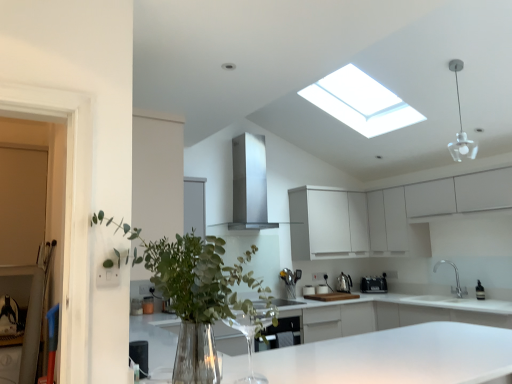
Question: Considering the relative positions of white glass pendant light at upper right and white glossy countertop at center in the image provided, is white glass pendant light at upper right to the left of white glossy countertop at center from the viewer's perspective?

Choices:
 (A) no
 (B) yes

Answer: (A)

Question: Can you confirm if white glass pendant light at upper right is taller than white glossy countertop at center?

Choices:
 (A) no
 (B) yes

Answer: (A)

Question: From a real-world perspective, is white glass pendant light at upper right located higher than white glossy countertop at center?

Choices:
 (A) yes
 (B) no

Answer: (A)

Question: Is white glass pendant light at upper right smaller than white glossy countertop at center?

Choices:
 (A) yes
 (B) no

Answer: (A)

Question: Is white glass pendant light at upper right further to camera compared to white glossy countertop at center?

Choices:
 (A) no
 (B) yes

Answer: (B)

Question: Considering the relative positions of white plastic toaster at center, the 3th appliance positioned from the right, and white glossy countertop at center in the image provided, is white plastic toaster at center, the 3th appliance positioned from the right, to the left or to the right of white glossy countertop at center?

Choices:
 (A) left
 (B) right

Answer: (B)

Question: Is white plastic toaster at center, the 3th appliance positioned from the right, inside the boundaries of white glossy countertop at center, or outside?

Choices:
 (A) inside
 (B) outside

Answer: (A)

Question: In terms of height, does white plastic toaster at center, the 3th appliance positioned from the right, look taller or shorter compared to white glossy countertop at center?

Choices:
 (A) short
 (B) tall

Answer: (A)

Question: Is white plastic toaster at center, the 3th appliance positioned from the right, bigger or smaller than white glossy countertop at center?

Choices:
 (A) small
 (B) big

Answer: (A)

Question: Considering the positions of point (456, 82) and point (373, 289), is point (456, 82) closer or farther from the camera than point (373, 289)?

Choices:
 (A) farther
 (B) closer

Answer: (B)

Question: In terms of height, does white glass pendant light at upper right look taller or shorter compared to metallic silver toaster at lower center, acting as the third appliance starting from the left?

Choices:
 (A) short
 (B) tall

Answer: (B)

Question: Based on their positions, is white glass pendant light at upper right located to the left or right of metallic silver toaster at lower center, which is counted as the first appliance, starting from the right?

Choices:
 (A) left
 (B) right

Answer: (B)

Question: Relative to metallic silver toaster at lower center, acting as the third appliance starting from the left, is white glass pendant light at upper right in front or behind?

Choices:
 (A) behind
 (B) front

Answer: (B)

Question: From the image's perspective, relative to white glass pendant light at upper right, is white glossy countertop at center above or below?

Choices:
 (A) above
 (B) below

Answer: (B)

Question: Is point (231, 362) positioned closer to the camera than point (458, 61)?

Choices:
 (A) closer
 (B) farther

Answer: (A)